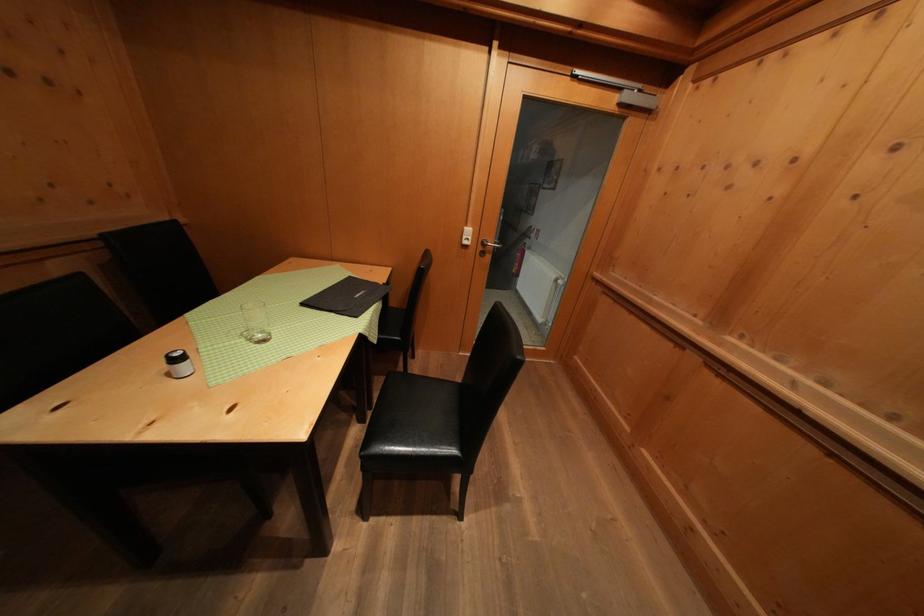
Where would you push the white light switch? Please return your answer as a coordinate pair (x, y).

(466, 236)